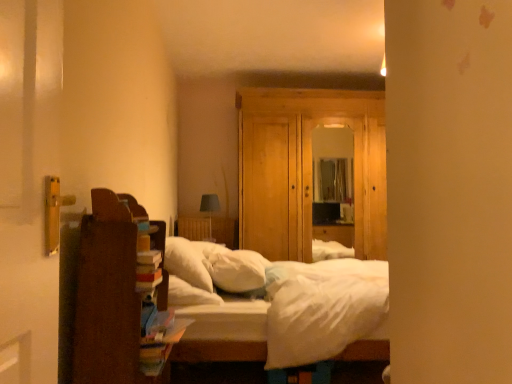
Question: Based on their positions, is wooden dresser at center located to the left or right of brown wooden bookshelf at left?

Choices:
 (A) right
 (B) left

Answer: (A)

Question: In the image, is wooden dresser at center positioned in front of or behind brown wooden bookshelf at left?

Choices:
 (A) front
 (B) behind

Answer: (B)

Question: Which object is the farthest from the white soft pillow at center, which is the first pillow from right to left?

Choices:
 (A) wooden dresser at center
 (B) white soft pillow at center, the 1th pillow from the left
 (C) white soft bed at center
 (D) brown wooden bookshelf at left

Answer: (A)

Question: Estimate the real-world distances between objects in this image. Which object is farther from the white soft pillow at center, which is the first pillow from right to left?

Choices:
 (A) brown wooden bookshelf at left
 (B) white soft pillow at center, the 1th pillow from the left
 (C) wooden dresser at center
 (D) white soft bed at center

Answer: (C)